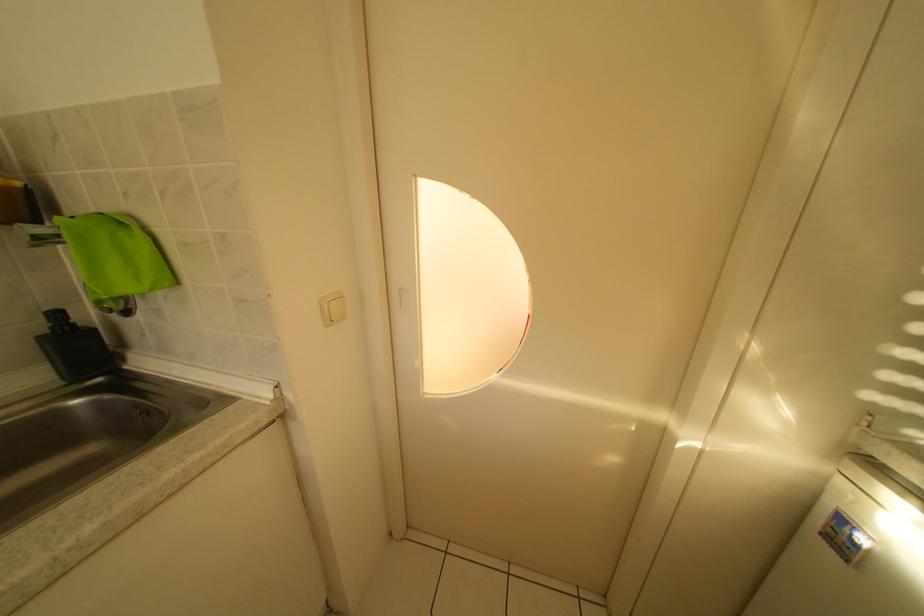
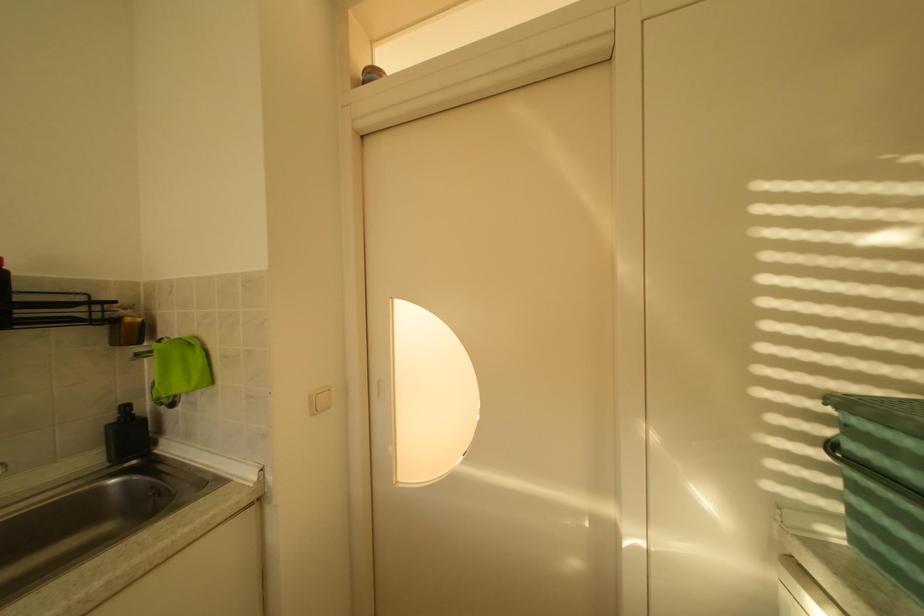
Consider the image. Which direction would the cameraman need to move to produce the second image?

The cameraman moved toward right, backward.